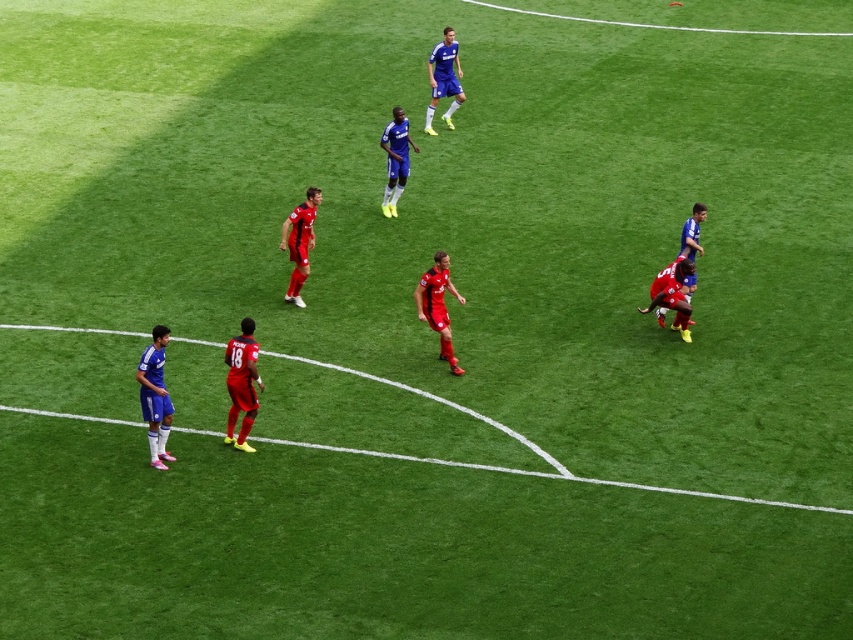
Is point (157, 426) more distant than point (419, 310)?

No, it is in front of (419, 310).

Between point (149, 445) and point (450, 362), which one is positioned behind?

Positioned behind is point (450, 362).

Locate an element on the screen. Image resolution: width=853 pixels, height=640 pixels. blue jersey at lower left is located at coordinates (155, 396).

Between point (701, 216) and point (409, 144), which one is positioned behind?

The point (409, 144) is more distant.

Is point (459, 292) positioned behind point (392, 145)?

No, (459, 292) is in front of (392, 145).

Between point (651, 307) and point (380, 138), which one is positioned behind?

The point (380, 138) is more distant.

Locate an element on the screen. The width and height of the screenshot is (853, 640). shiny red shorts at lower left is located at coordinates (683, 304).

Is blue matte jersey at upper center to the right of matte blue soccer player at center from the viewer's perspective?

Indeed, blue matte jersey at upper center is positioned on the right side of matte blue soccer player at center.

Does point (444, 65) come in front of point (387, 166)?

No, (444, 65) is behind (387, 166).

Identify the location of blue matte jersey at upper center. (444, 77).